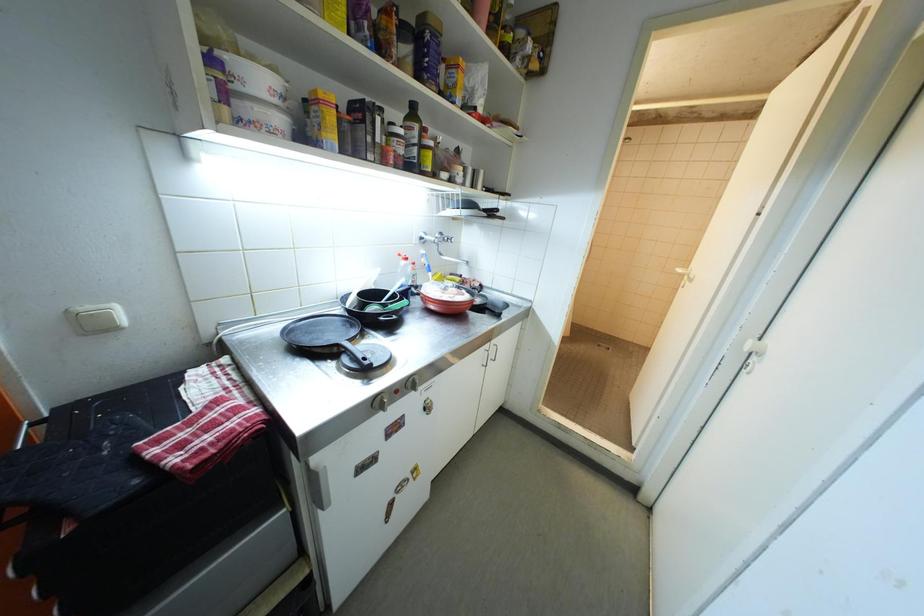
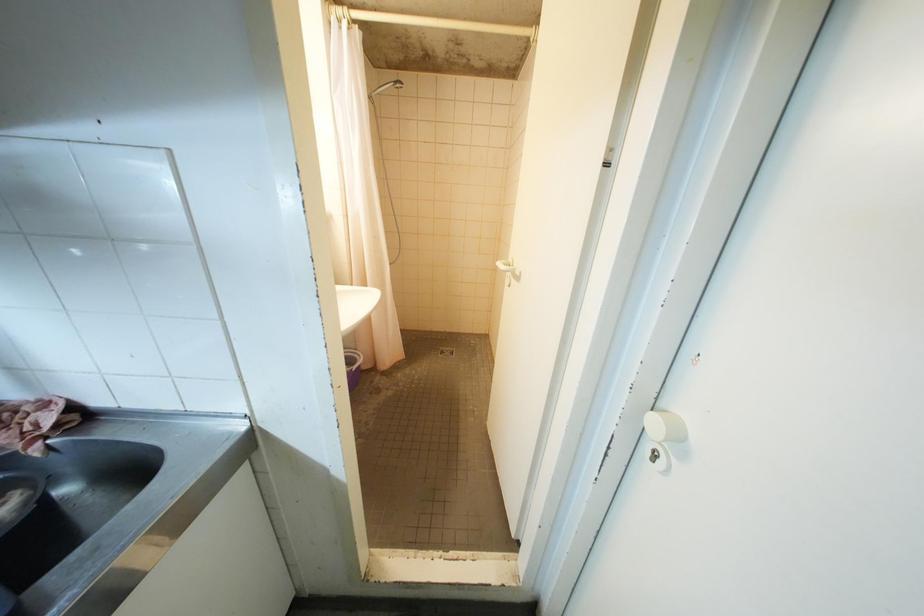
Question: The camera is either moving clockwise (left) or counter-clockwise (right) around the object. The first image is from the beginning of the video and the second image is from the end. Is the camera moving left or right when shooting the video?

Choices:
 (A) Left
 (B) Right

Answer: (A)